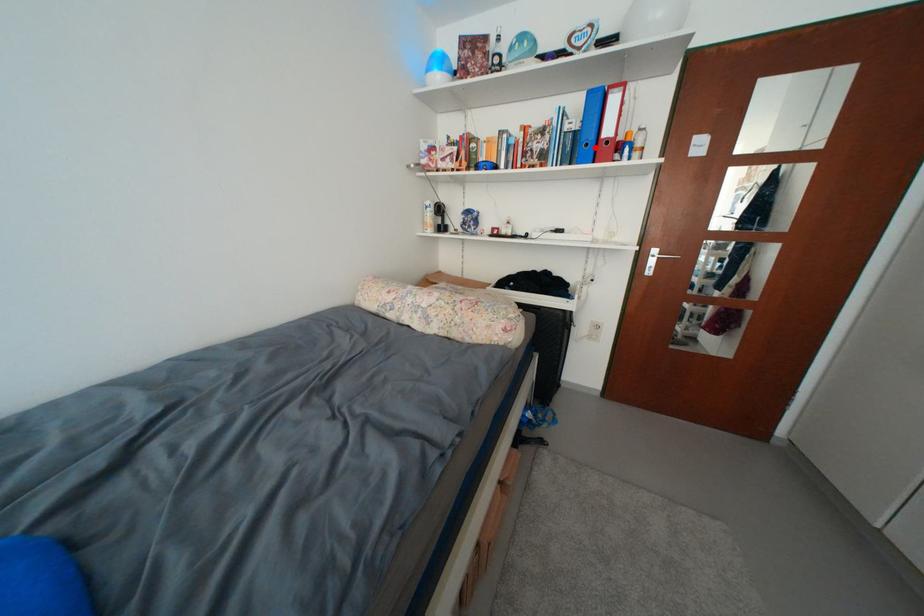
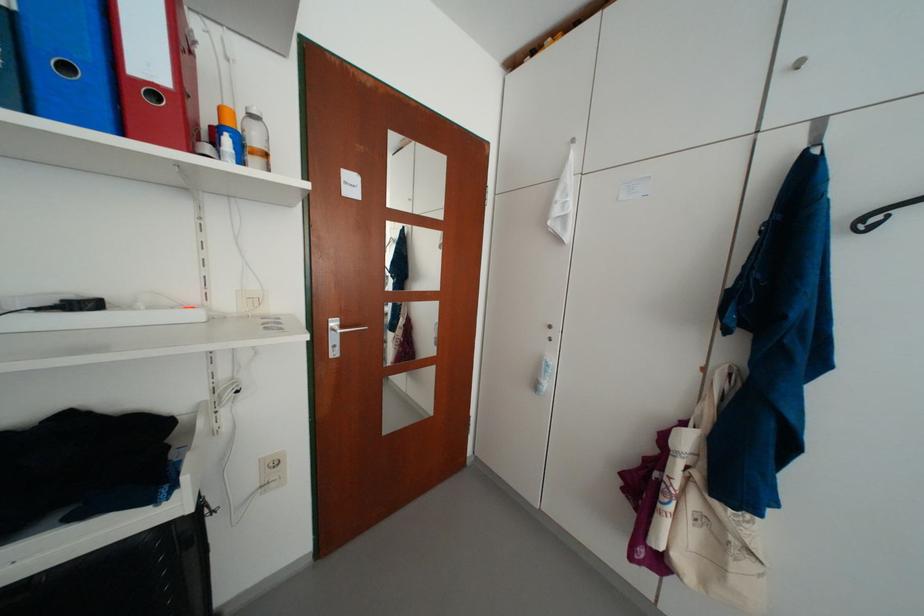
Question: I am providing you with two images of the same scene from different viewpoints. Image1 has a red point marked. In image2, the corresponding 3D location appears at what relative position? Reply with the corresponding letter.

Choices:
 (A) Closer
 (B) Farther

Answer: (B)